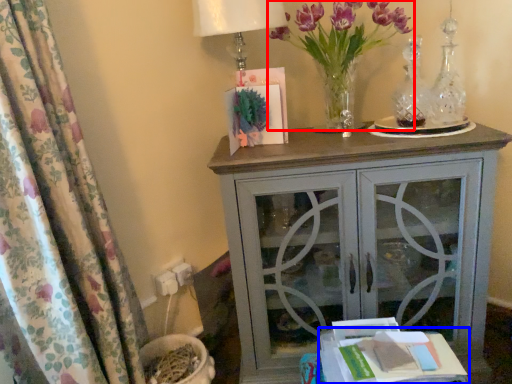
Question: Which of the following is the farthest to the observer, floral arrangement (highlighted by a red box) or table (highlighted by a blue box)?

Choices:
 (A) floral arrangement
 (B) table

Answer: (A)